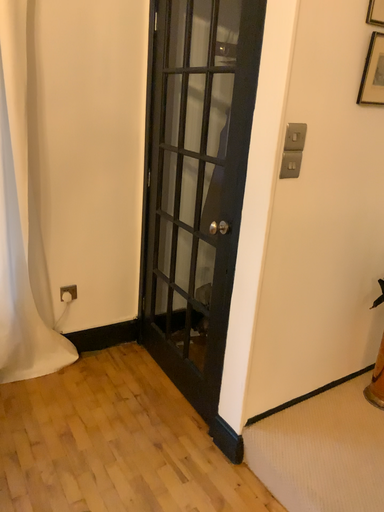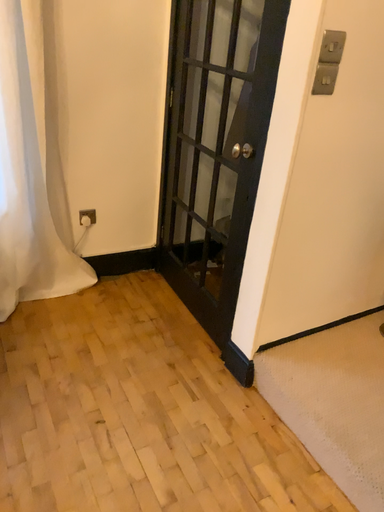
Question: How did the camera likely rotate when shooting the video?

Choices:
 (A) rotated downward
 (B) rotated upward

Answer: (A)